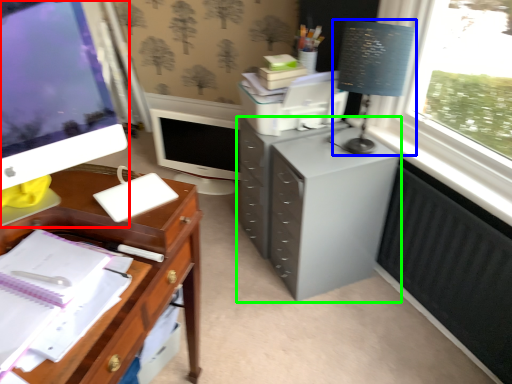
Question: Considering the real-world distances, which object is farthest from computer monitor (highlighted by a red box)? table lamp (highlighted by a blue box) or filing cabinet (highlighted by a green box)?

Choices:
 (A) table lamp
 (B) filing cabinet

Answer: (A)